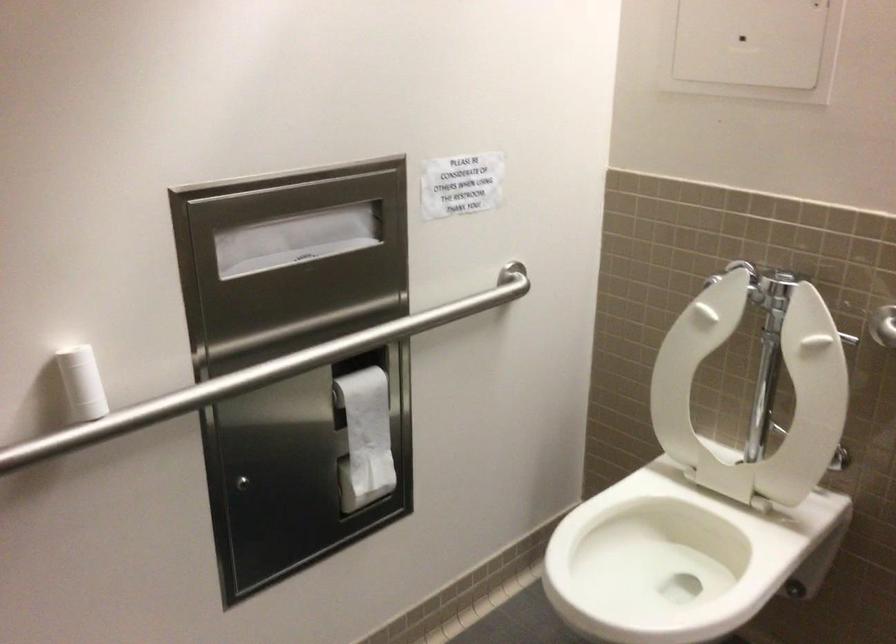
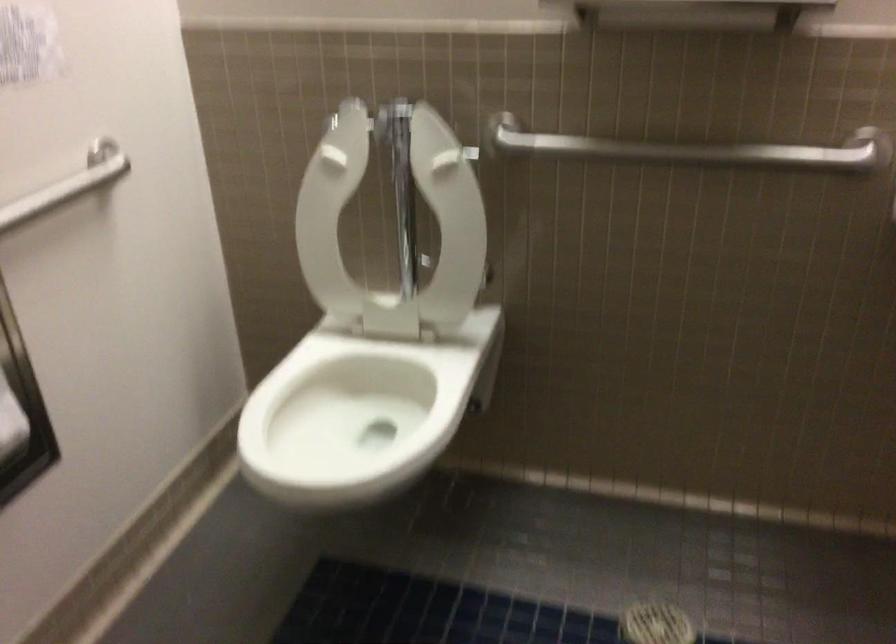
Question: The first image is from the beginning of the video and the second image is from the end. How did the camera likely rotate when shooting the video?

Choices:
 (A) Left
 (B) Right
 (C) Up
 (D) Down

Answer: (B)